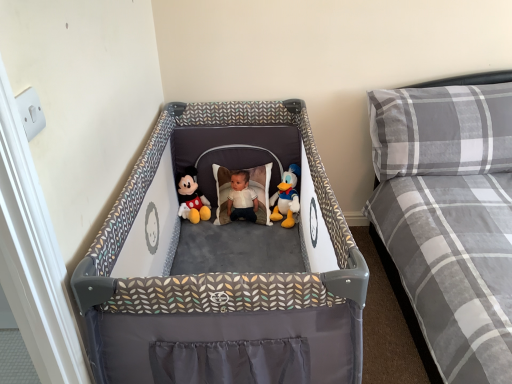
Question: Is gray plaid mattress at right outside matte plush mickey mouse at center, arranged as the 1th toy when viewed from the left?

Choices:
 (A) yes
 (B) no

Answer: (A)

Question: From a real-world perspective, is gray plaid mattress at right located higher than matte plush mickey mouse at center, which is counted as the second toy, starting from the right?

Choices:
 (A) yes
 (B) no

Answer: (A)

Question: Is gray plaid mattress at right looking in the opposite direction of matte plush mickey mouse at center, which is counted as the second toy, starting from the right?

Choices:
 (A) no
 (B) yes

Answer: (A)

Question: Does gray plaid mattress at right have a lesser height compared to matte plush mickey mouse at center, arranged as the 1th toy when viewed from the left?

Choices:
 (A) yes
 (B) no

Answer: (B)

Question: Is gray plaid mattress at right smaller than matte plush mickey mouse at center, arranged as the 1th toy when viewed from the left?

Choices:
 (A) no
 (B) yes

Answer: (A)

Question: Is matte plush mickey mouse at center, which is counted as the second toy, starting from the right, a part of gray plaid mattress at right?

Choices:
 (A) yes
 (B) no

Answer: (B)

Question: Could you tell me if white plush duck at center, which appears as the 2th toy when viewed from the left, is turned towards matte plush mickey mouse at center, which is counted as the second toy, starting from the right?

Choices:
 (A) yes
 (B) no

Answer: (B)

Question: From the image's perspective, does white plush duck at center, which appears as the 2th toy when viewed from the left, appear lower than matte plush mickey mouse at center, which is counted as the second toy, starting from the right?

Choices:
 (A) yes
 (B) no

Answer: (B)

Question: Does white plush duck at center, which appears as the 2th toy when viewed from the left, have a smaller size compared to matte plush mickey mouse at center, arranged as the 1th toy when viewed from the left?

Choices:
 (A) yes
 (B) no

Answer: (A)

Question: Does white plush duck at center, the 1th toy when ordered from right to left, have a lesser height compared to matte plush mickey mouse at center, which is counted as the second toy, starting from the right?

Choices:
 (A) no
 (B) yes

Answer: (A)

Question: Are white plush duck at center, which appears as the 2th toy when viewed from the left, and matte plush mickey mouse at center, arranged as the 1th toy when viewed from the left, located far from each other?

Choices:
 (A) no
 (B) yes

Answer: (A)

Question: Is white plush duck at center, which appears as the 2th toy when viewed from the left, bigger than matte plush mickey mouse at center, arranged as the 1th toy when viewed from the left?

Choices:
 (A) yes
 (B) no

Answer: (B)

Question: Does gray plaid pillow at upper right turn towards gray plaid mattress at right?

Choices:
 (A) yes
 (B) no

Answer: (A)